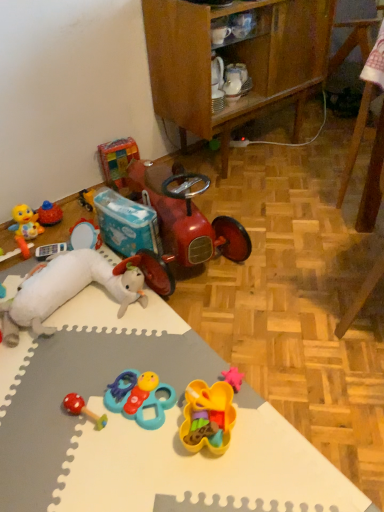
Find the location of `free point in front of teal plastic toy at center, which ranks as the 3th toy in top-to-bottom order`. free point in front of teal plastic toy at center, which ranks as the 3th toy in top-to-bottom order is located at coordinates (138, 463).